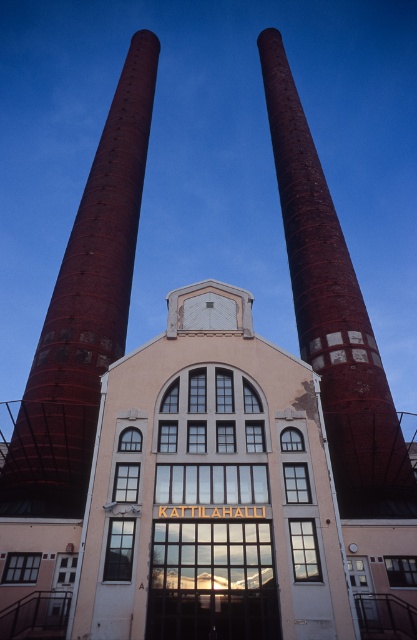
You are standing at the base of the two chimneys in the scene. There is a point marked at coordinates point (x=22, y=477) that you need to reach. Given that your current position is 10 meters away from the camera, can you determine if the point is within a 50 meter range from you?

The distance of point (x=22, y=477) from the camera is 43.95 meters. Since you are 10 meters away from the camera, the point is 43.95 meters minus 10 meters equals 33.95 meters away from you. This is within the 50 meter range, so yes, the point is within 50 meters from your current position.